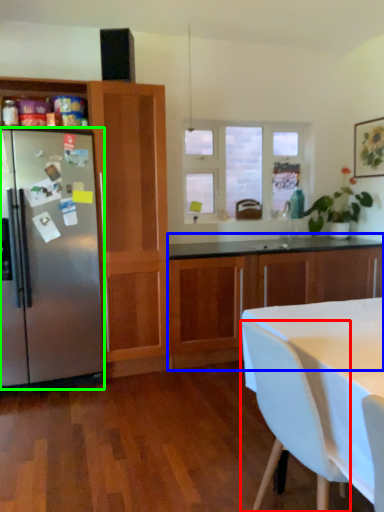
Question: Based on their relative distances, which object is farther from chair (highlighted by a red box)? Choose from cabinetry (highlighted by a blue box) and refrigerator (highlighted by a green box).

Choices:
 (A) cabinetry
 (B) refrigerator

Answer: (A)